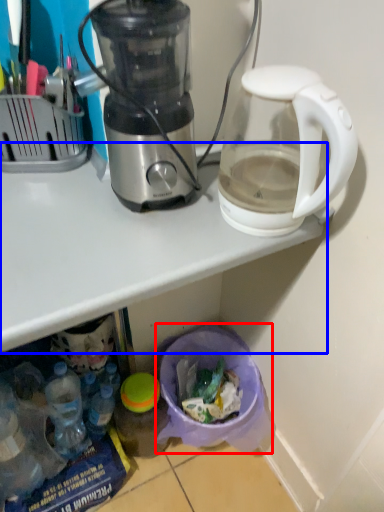
Question: Which point is further to the camera, garbage (highlighted by a red box) or table (highlighted by a blue box)?

Choices:
 (A) garbage
 (B) table

Answer: (A)